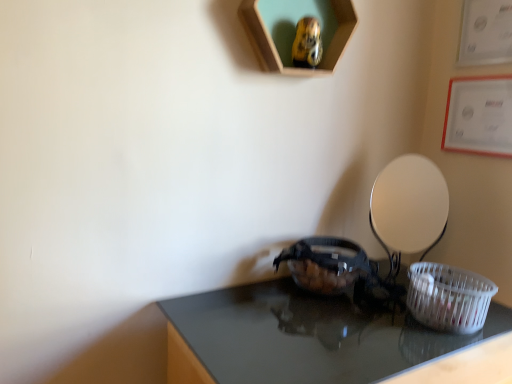
I want to click on free space in front of white plastic basket at lower right, so click(x=455, y=357).